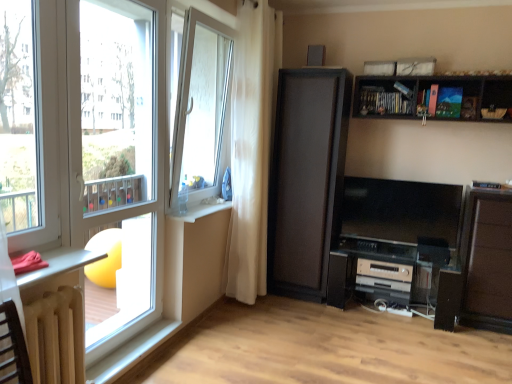
At what (x,y) coordinates should I click in order to perform the action: click on vacant space that's between matte black cabinet at lower right and silver metallic stereo at lower center, the 2th appliance when ordered from top to bottom. Please return your answer as a coordinate pair (x, y). The width and height of the screenshot is (512, 384). Looking at the image, I should click on (476, 335).